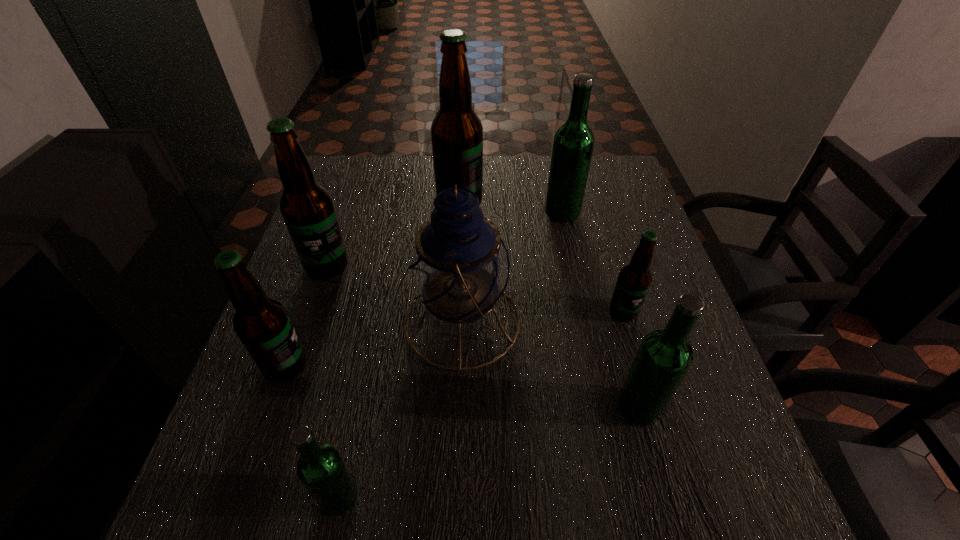
Image resolution: width=960 pixels, height=540 pixels. In order to click on free space in the image that satisfies the following two spatial constraints: 1. on the front-facing side of the blue lantern; 2. on the back side of the sixth farthest beer bottle in this screenshot , I will do `click(459, 407)`.